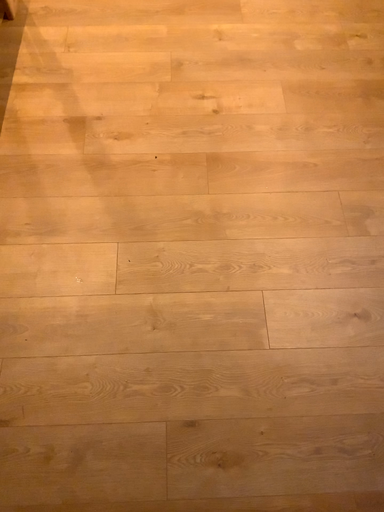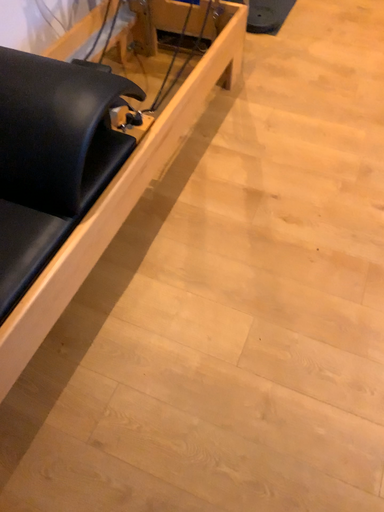
Question: How did the camera likely rotate when shooting the video?

Choices:
 (A) rotated left
 (B) rotated right

Answer: (A)